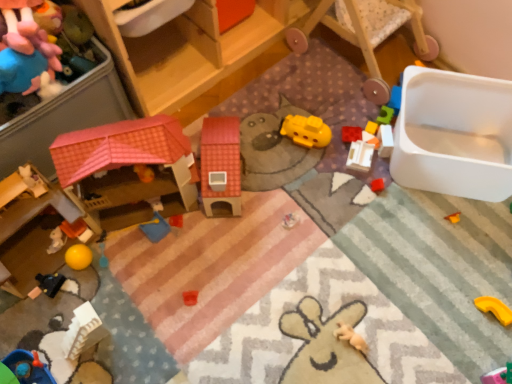
Find the location of a particular element. The width and height of the screenshot is (512, 384). empty space that is in between yellow matte block at upper right, positioned as the 3th toy in right-to-left order, and blue fabric toy at center, acting as the ninth toy starting from the right is located at coordinates (271, 179).